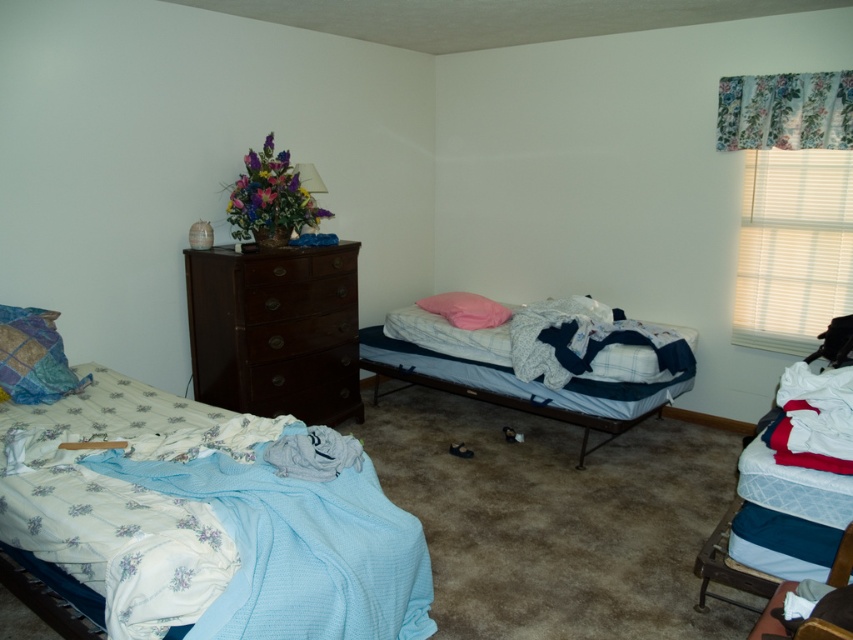
Where is the quilted fabric pillow at left located in the image?

The quilted fabric pillow at left is located at point (x=33, y=356) in the image.

You are standing in the bedroom and want to place a small book on the closest object to you between the quilted fabric pillow at left and the brown wood drawer at center left. Which object should you place the book on?

The quilted fabric pillow at left is closer to the viewer than the brown wood drawer at center left, so you should place the book on the quilted fabric pillow at left.

You are standing in the bedroom and want to place a new nightstand between the two points, point (326, 410) and point (456, 304). Which point should the nightstand be closer to in order to be closer to the viewer?

The nightstand should be placed closer to point (326, 410) because it is closer to the viewer than point (456, 304).